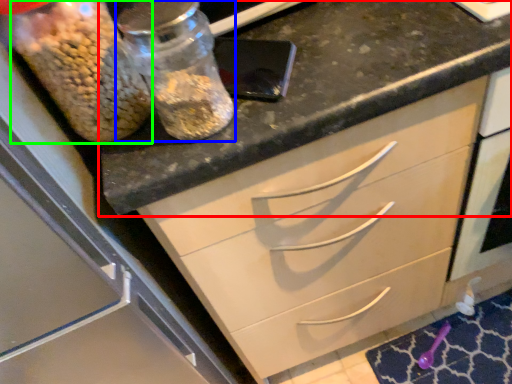
Question: Which object is positioned closest to countertop (highlighted by a red box)? Select from glass jar (highlighted by a blue box) and food (highlighted by a green box).

Choices:
 (A) glass jar
 (B) food

Answer: (A)